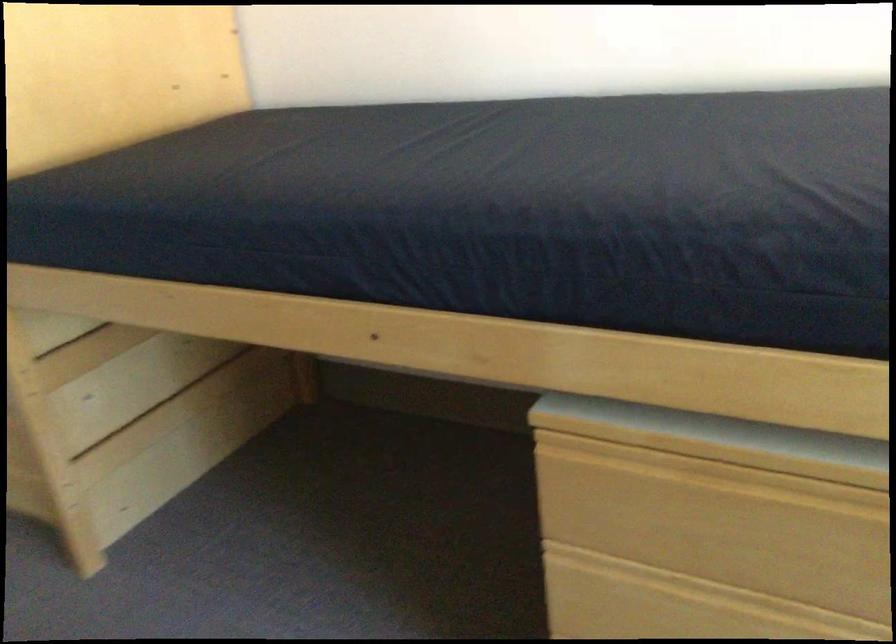
Identify the location of dark mattress surface. The width and height of the screenshot is (896, 644). (462, 200).